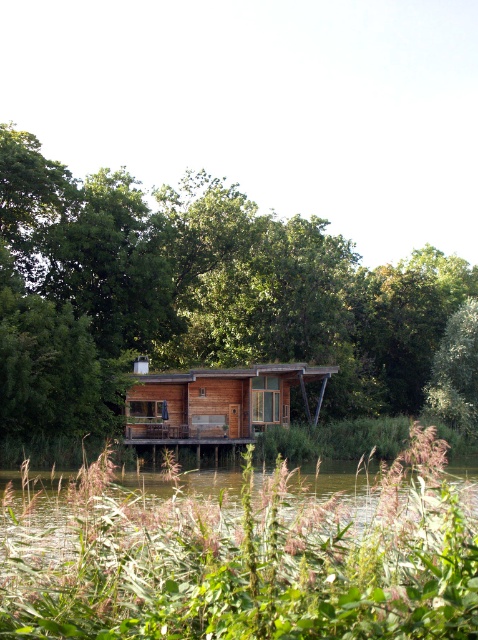
Looking at this image, you are standing at the entrance of the wooden cabin and want to take a photo of the green wood tree at center. Which direction should you face to capture it in your shot?

The green wood tree at center is located at point (x=194, y=296), so you should face towards the center of the image to capture it in your shot.

You are standing at the wooden deck in front of the cabin and want to walk to the point marked as point (90, 230) and point (456, 381). Which point should you reach first to stay closer to the cabin?

You should reach point (90, 230) first because it is closer to the viewer than point (456, 381), which is further away from the cabin.

You are planning to set up a picnic area between the green wood tree at center and the green leafy plants at lower center. Given that the distance between them is 33.86 meters, what is the maximum distance you can place your picnic blanket from each object to ensure it is equidistant from both?

The maximum distance you can place your picnic blanket from each object while being equidistant from both the green wood tree at center and the green leafy plants at lower center is 16.93 meters. This is calculated by dividing the total distance of 33.86 meters by 2, ensuring equal distance from both points.